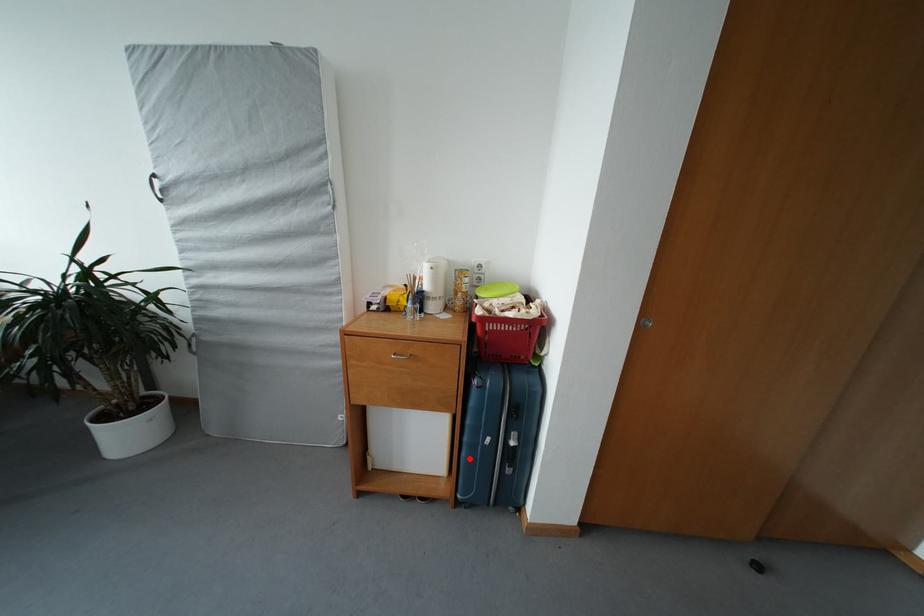
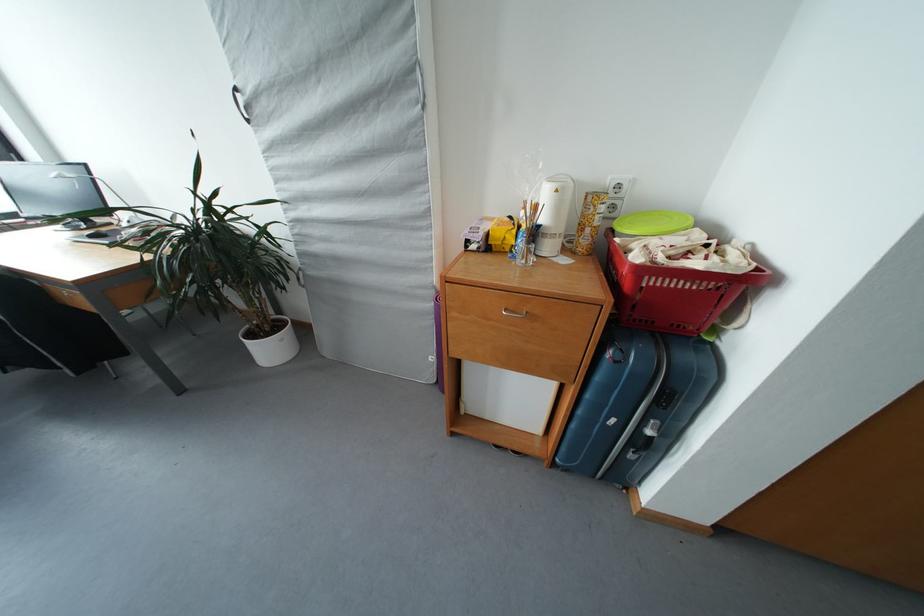
Question: I am providing you with two images of the same scene from different viewpoints. A red point is shown in image1. For the corresponding object point in image2, is it positioned nearer or farther from the camera?

Choices:
 (A) Nearer
 (B) Farther

Answer: (A)